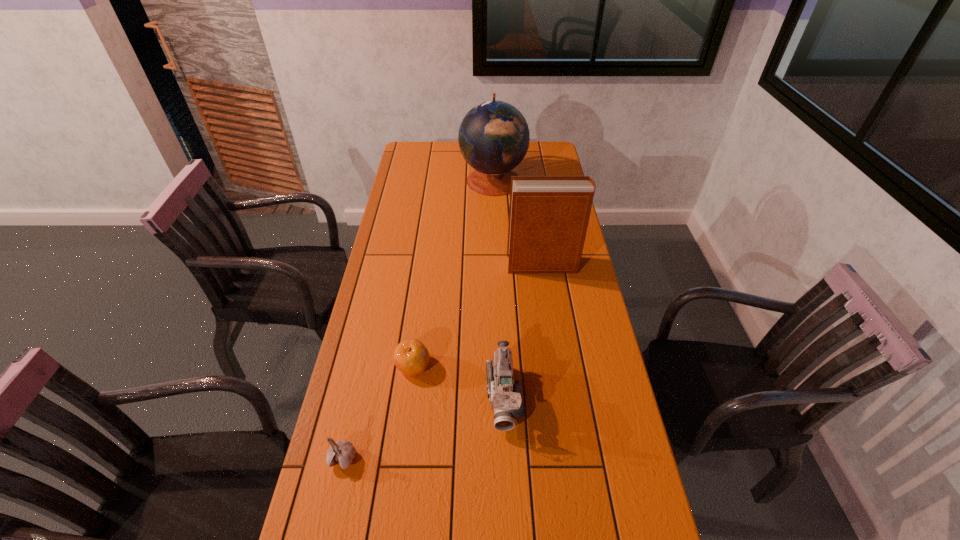
At what (x,y) coordinates should I click in order to perform the action: click on object that is the closest one to the nearest object. Please return your answer as a coordinate pair (x, y). Image resolution: width=960 pixels, height=540 pixels. Looking at the image, I should click on 411,357.

Point out which object is positioned as the nearest to the hardback book. Please provide its 2D coordinates. Your answer should be formatted as a tuple, i.e. [(x, y)], where the tuple contains the x and y coordinates of a point satisfying the conditions above.

[(494, 137)]